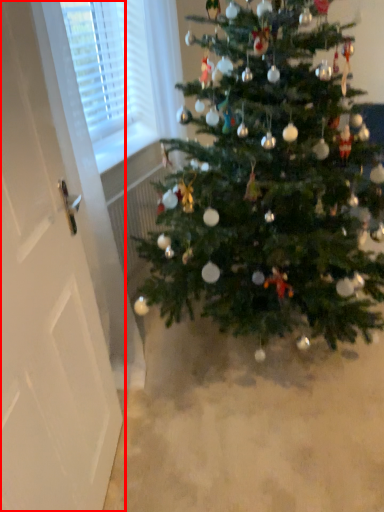
Question: Observing the image, what is the correct spatial positioning of screen door (annotated by the red box) in reference to christmas tree?

Choices:
 (A) right
 (B) left

Answer: (B)